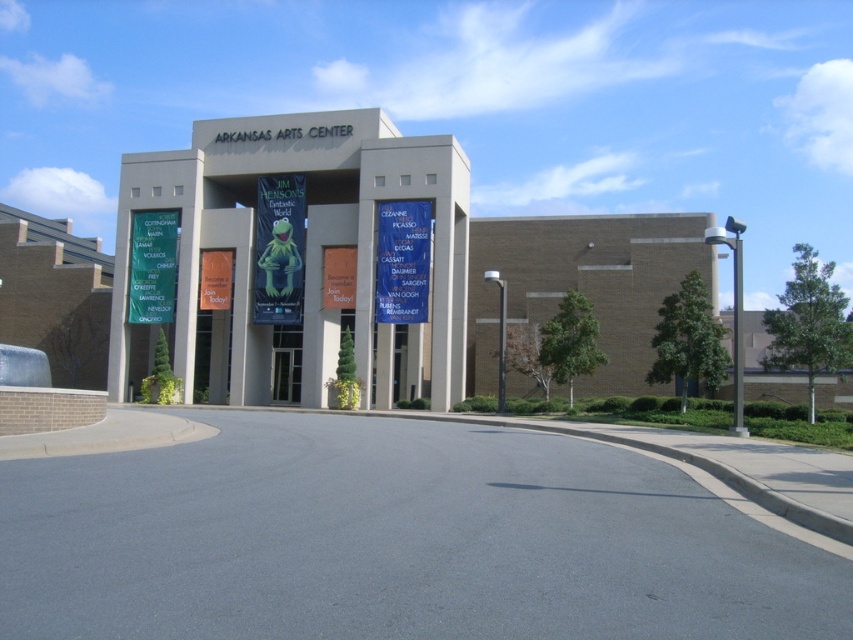
You are standing in front of the Arkansas Arts Center and notice two green banners. The green fabric sign at left and the matte green banner at center. Which one is higher up?

The green fabric sign at left is above the matte green banner at center, so it is higher up.